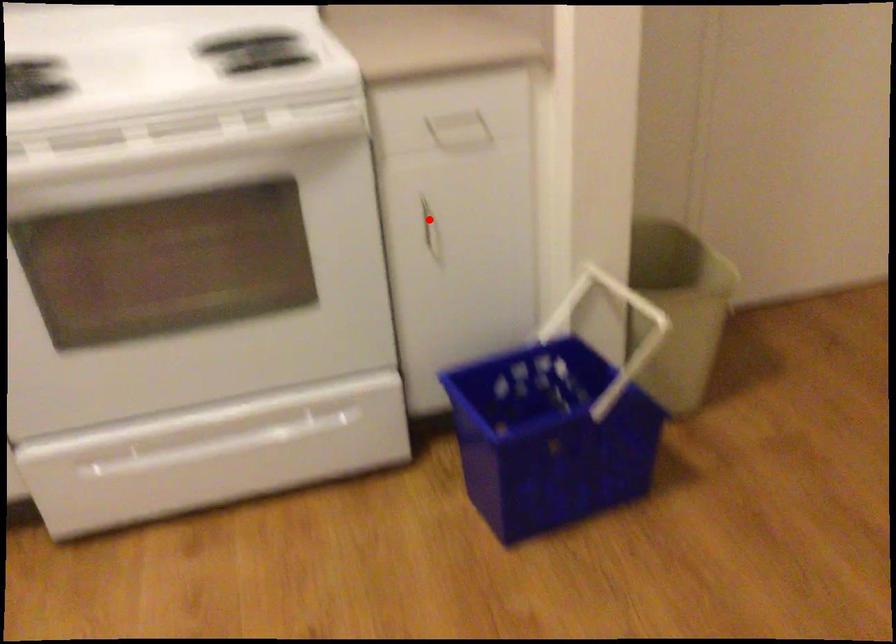
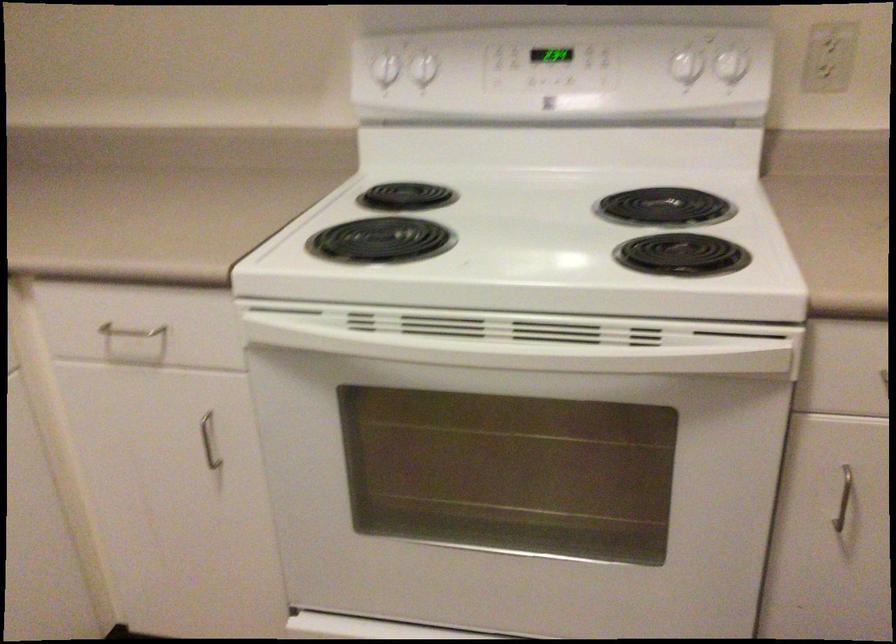
In the second image, find the point that corresponds to the highlighted location in the first image.

(842, 498)